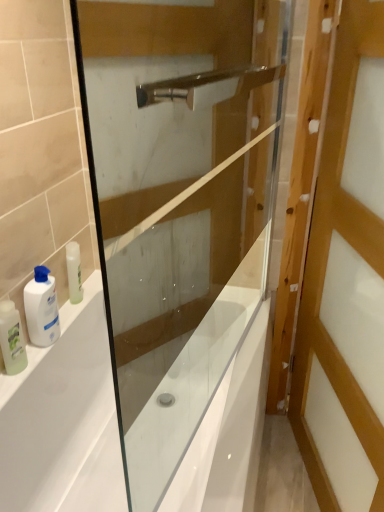
Question: Is white glossy bathtub at lower left facing towards wooden door at right?

Choices:
 (A) yes
 (B) no

Answer: (A)

Question: Can you confirm if white glossy bathtub at lower left is thinner than wooden door at right?

Choices:
 (A) yes
 (B) no

Answer: (B)

Question: Would you say wooden door at right is part of white glossy bathtub at lower left's contents?

Choices:
 (A) yes
 (B) no

Answer: (B)

Question: From a real-world perspective, is white glossy bathtub at lower left below wooden door at right?

Choices:
 (A) yes
 (B) no

Answer: (A)

Question: Is the surface of white glossy bathtub at lower left in direct contact with wooden door at right?

Choices:
 (A) no
 (B) yes

Answer: (A)

Question: From the image's perspective, is wooden door at right located above or below transparent glass screen door at center?

Choices:
 (A) below
 (B) above

Answer: (A)

Question: Based on their positions, is wooden door at right located to the left or right of transparent glass screen door at center?

Choices:
 (A) left
 (B) right

Answer: (B)

Question: Is wooden door at right inside or outside of transparent glass screen door at center?

Choices:
 (A) outside
 (B) inside

Answer: (A)

Question: In terms of width, does wooden door at right look wider or thinner when compared to transparent glass screen door at center?

Choices:
 (A) thin
 (B) wide

Answer: (B)

Question: Is transparent glass screen door at center wider or thinner than wooden door at right?

Choices:
 (A) thin
 (B) wide

Answer: (A)

Question: From a real-world perspective, relative to wooden door at right, is transparent glass screen door at center vertically above or below?

Choices:
 (A) below
 (B) above

Answer: (B)

Question: Is transparent glass screen door at center bigger or smaller than wooden door at right?

Choices:
 (A) big
 (B) small

Answer: (B)

Question: Is transparent glass screen door at center to the left or to the right of wooden door at right in the image?

Choices:
 (A) left
 (B) right

Answer: (A)

Question: Do you think white glossy bathtub at lower left is within wooden door at right, or outside of it?

Choices:
 (A) inside
 (B) outside

Answer: (B)

Question: Is point (3, 459) positioned closer to the camera than point (375, 377)?

Choices:
 (A) farther
 (B) closer

Answer: (A)